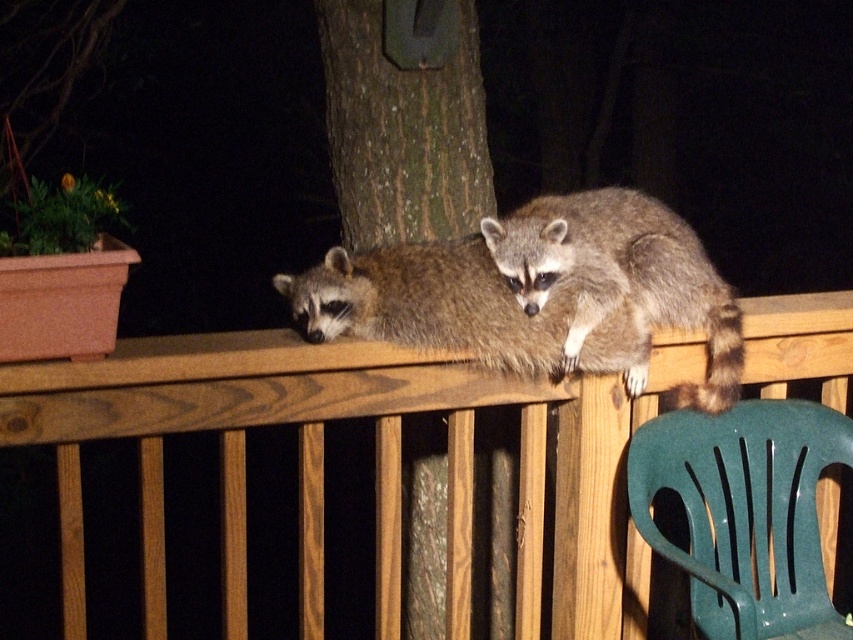
Is the position of brown rough bark tree at center less distant than that of fuzzy brown raccoon at upper right?

No, brown rough bark tree at center is further to the viewer.

Between brown rough bark tree at center and fuzzy brown raccoon at upper right, which one is positioned lower?

fuzzy brown raccoon at upper right

Who is more forward, (465, 154) or (492, 221)?

Point (492, 221)

This screenshot has width=853, height=640. I want to click on brown rough bark tree at center, so click(402, 131).

Is brown rough bark tree at center thinner than fuzzy brown raccoon at upper center?

Yes, brown rough bark tree at center is thinner than fuzzy brown raccoon at upper center.

From the picture: Is brown rough bark tree at center behind fuzzy brown raccoon at upper center?

That is True.

The width and height of the screenshot is (853, 640). Find the location of `brown rough bark tree at center`. brown rough bark tree at center is located at coordinates (402, 131).

Can you confirm if wooden rail at upper center is thinner than green plastic chair at lower right?

Incorrect, wooden rail at upper center's width is not less than green plastic chair at lower right's.

Who is more forward, (521, 499) or (682, 435)?

Positioned in front is point (682, 435).

The image size is (853, 640). Find the location of `wooden rail at upper center`. wooden rail at upper center is located at coordinates (374, 461).